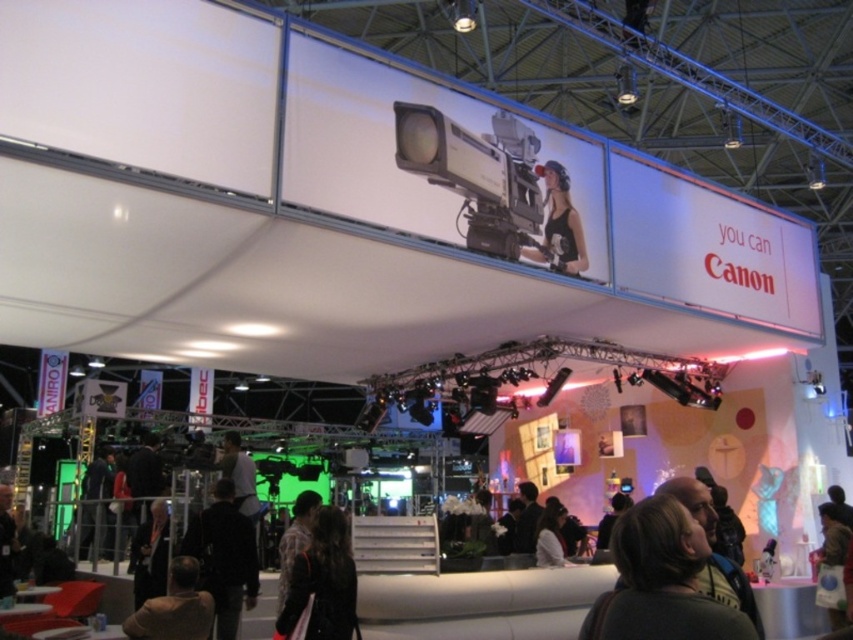
Question: Estimate the real-world distances between objects in this image. Which object is farther from the dark brown leather jacket at lower center?

Choices:
 (A) dark brown hair at center
 (B) dark brown leather jacket at center

Answer: (B)

Question: Does dark brown leather jacket at lower center lie behind brown leather jacket at lower left?

Choices:
 (A) no
 (B) yes

Answer: (A)

Question: Is black fabric jacket at lower center below matte black camera at upper center?

Choices:
 (A) yes
 (B) no

Answer: (A)

Question: Estimate the real-world distances between objects in this image. Which object is closer to the matte black camera at upper center?

Choices:
 (A) dark brown leather jacket at lower center
 (B) black fabric jacket at lower center
 (C) dark brown leather jacket at center
 (D) dark brown hair at center

Answer: (C)

Question: Which of the following is the closest to the observer?

Choices:
 (A) (331, 605)
 (B) (532, 260)
 (C) (213, 496)
 (D) (560, 536)

Answer: (A)

Question: Is matte black camera at upper center smaller than dark brown leather jacket at center?

Choices:
 (A) yes
 (B) no

Answer: (B)